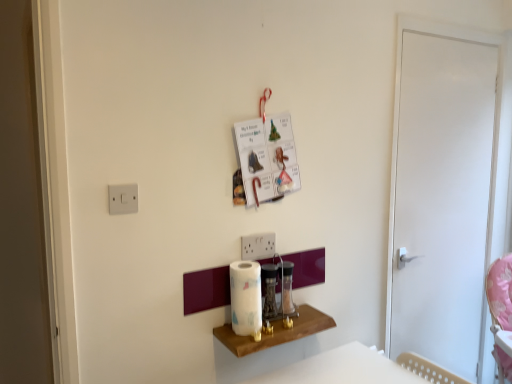
Question: In terms of width, does white plastic light switch at upper left look wider or thinner when compared to clear glass jar at center, placed as the 2th appliance when sorted from left to right?

Choices:
 (A) thin
 (B) wide

Answer: (A)

Question: In terms of height, does white plastic light switch at upper left look taller or shorter compared to clear glass jar at center, placed as the 2th appliance when sorted from left to right?

Choices:
 (A) short
 (B) tall

Answer: (A)

Question: Estimate the real-world distances between objects in this image. Which object is farther from the white glossy paper towel at center?

Choices:
 (A) white glossy door at right
 (B) wooden shelf at center
 (C) clear glass jar at center, placed as the 2th appliance when sorted from left to right
 (D) metallic silver blender at center, placed as the 2th appliance when sorted from right to left
 (E) white plastic light switch at upper left

Answer: (A)

Question: Estimate the real-world distances between objects in this image. Which object is farther from the white glossy paper towel at center?

Choices:
 (A) metallic silver blender at center, placed as the first appliance when sorted from left to right
 (B) white plastic light switch at upper left
 (C) white glossy door at right
 (D) wooden shelf at center
 (E) clear glass jar at center, which is counted as the 1th appliance, starting from the right

Answer: (C)